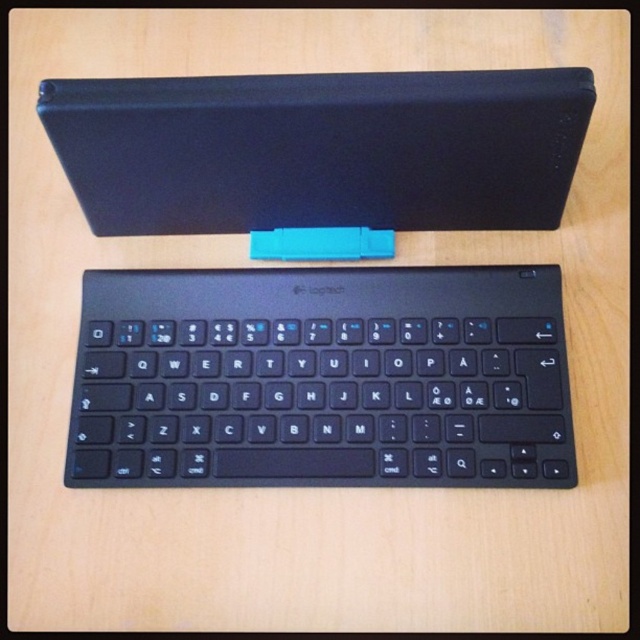
You are setting up a workspace and have a black matte keyboard at center and a black matte laptop at upper center. Which object is thinner?

The black matte keyboard at center is thinner than the black matte laptop at upper center.

You are holding a smartphone 3 feet away from the black matte keyboard at center. Can you take a clear photo of the keyboard without moving closer?

The black matte keyboard at center is 3.37 feet away from the camera. Since your smartphone is 3 feet away, you are closer than the required distance, so you can take a clear photo without moving closer.

You are setting up your workspace and need to place a cup between the black matte keyboard at center and the black matte laptop at upper center. The cup has a diameter of 3 inches. Is there enough space between them to place the cup?

The black matte keyboard at center is 8.33 inches away from the black matte laptop at upper center. Since the cup has a diameter of 3 inches, there is sufficient space between them to place the cup as the distance is greater than the cup size.